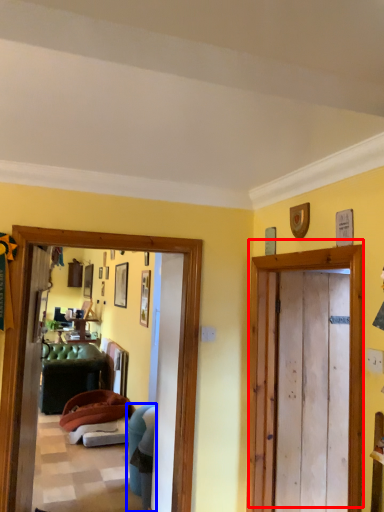
Question: Which of the following is the farthest to the observer, door (highlighted by a red box) or chair (highlighted by a blue box)?

Choices:
 (A) door
 (B) chair

Answer: (B)